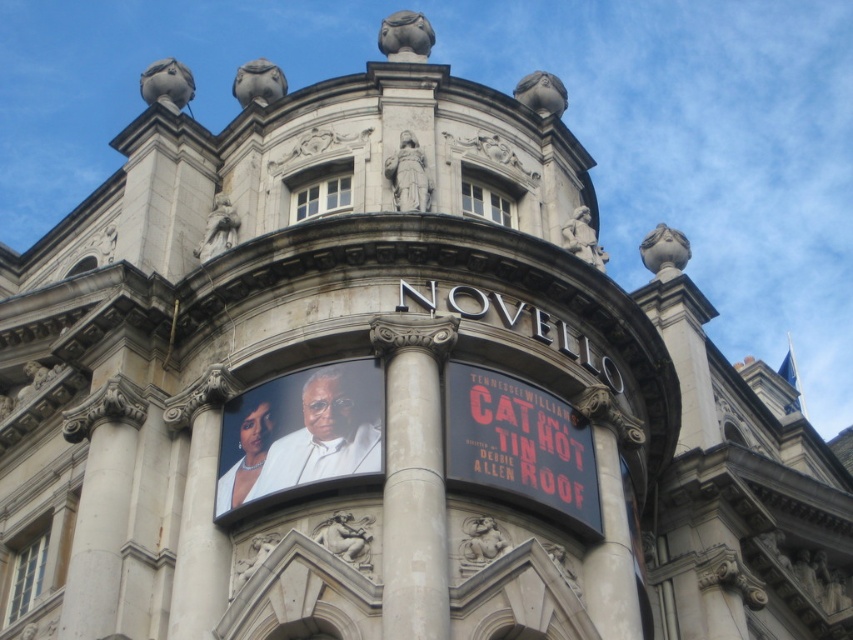
Find the location of a particular element. white stone column at center is located at coordinates (413, 476).

Is white stone column at center smaller than white stone pillar at center?

No.

Which is in front, point (445, 586) or point (593, 579)?

Point (445, 586) is more forward.

At what (x,y) coordinates should I click in order to perform the action: click on white stone column at center. Please return your answer as a coordinate pair (x, y). This screenshot has width=853, height=640. Looking at the image, I should click on (413, 476).

Is black matte sign at center shorter than white stone pillar at center?

Indeed, black matte sign at center has a lesser height compared to white stone pillar at center.

Which of these two, black matte sign at center or white stone pillar at center, stands taller?

Standing taller between the two is white stone pillar at center.

Find the location of `black matte sign at center`. black matte sign at center is located at coordinates (519, 442).

At what (x,y) coordinates should I click in order to perform the action: click on black matte sign at center. Please return your answer as a coordinate pair (x, y). Image resolution: width=853 pixels, height=640 pixels. Looking at the image, I should click on (519, 442).

Between point (434, 428) and point (456, 396), which one is positioned in front?

Positioned in front is point (434, 428).

At what (x,y) coordinates should I click in order to perform the action: click on white stone column at center. Please return your answer as a coordinate pair (x, y). Looking at the image, I should click on (413, 476).